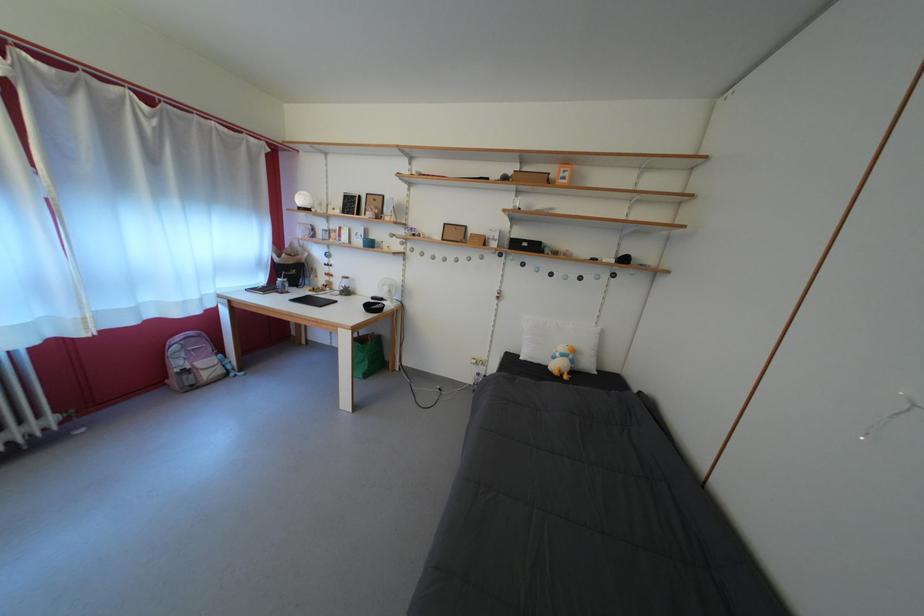
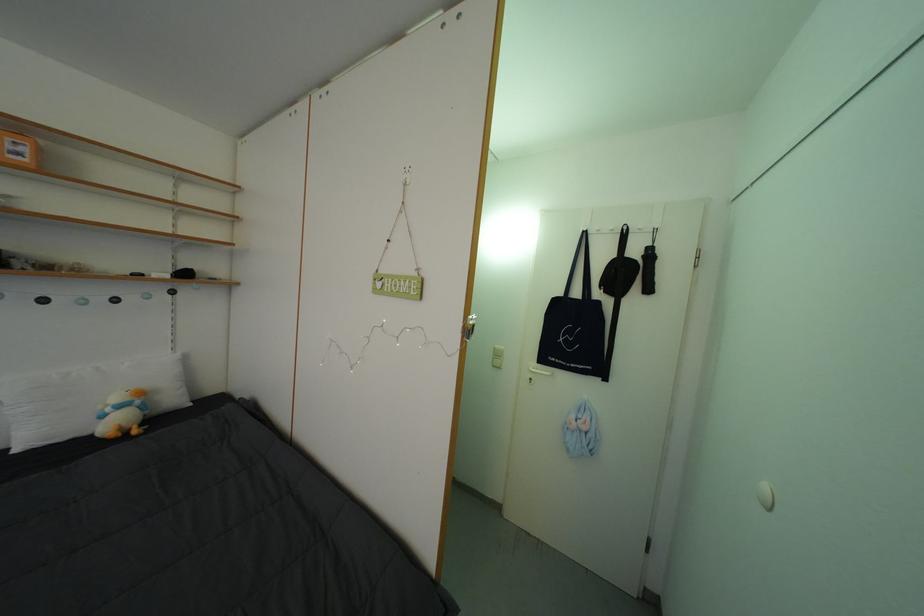
Where in the second image is the point corresponding to the point at 573,184 from the first image?

(27, 160)